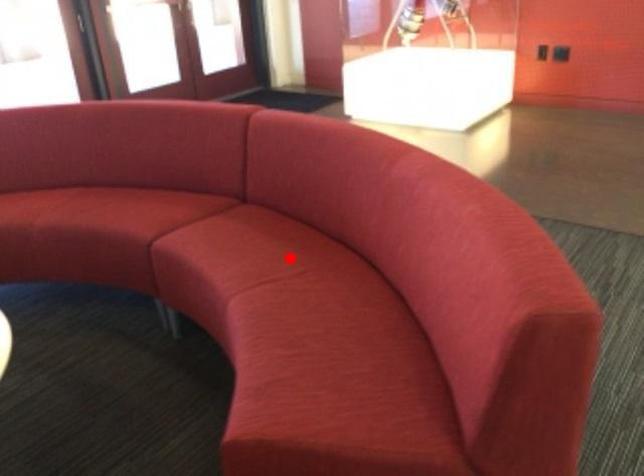
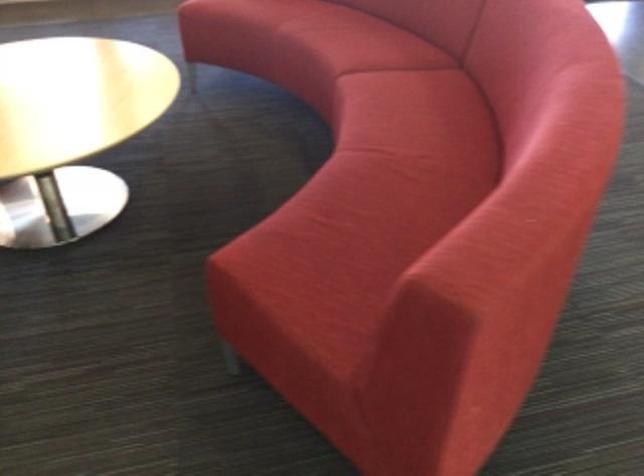
Find the pixel in the second image that matches the highlighted location in the first image.

(422, 135)